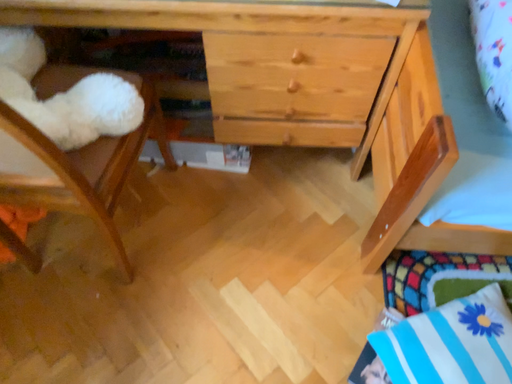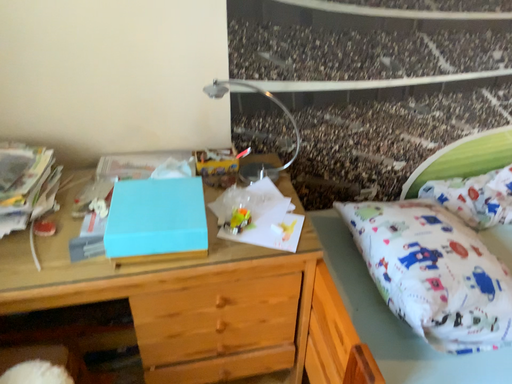
Question: How did the camera likely rotate when shooting the video?

Choices:
 (A) rotated right
 (B) rotated left

Answer: (A)